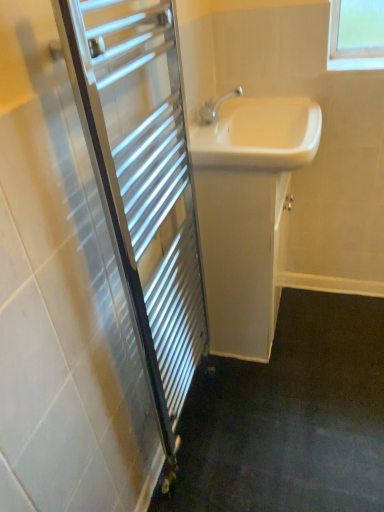
You are a GUI agent. You are given a task and a screenshot of the screen. Output one action in this format:
    pyautogui.click(x=<x>, y=<y>)
    Task: Click on the free space to the right of white glossy cabinet at center
    Image resolution: width=384 pixels, height=512 pixels.
    Given the screenshot: What is the action you would take?
    pyautogui.click(x=327, y=326)